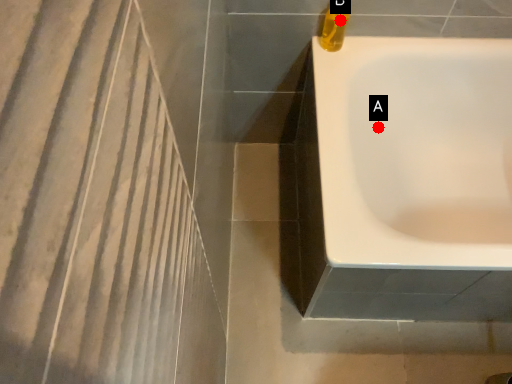
Question: Two points are circled on the image, labeled by A and B beside each circle. Among these points, which one is nearest to the camera?

Choices:
 (A) A is closer
 (B) B is closer

Answer: (B)